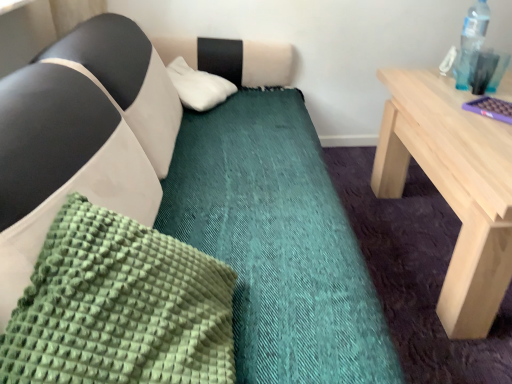
Identify the location of green textured pillow at lower left, arranged as the 1th pillow when viewed from the front. The image size is (512, 384). (119, 307).

Does point (469, 21) come in front of point (216, 84)?

Yes, point (469, 21) is in front of point (216, 84).

From a real-world perspective, who is located lower, transparent plastic bottle at upper right or white fluffy pillow at upper center, marked as the first pillow in a back-to-front arrangement?

white fluffy pillow at upper center, marked as the first pillow in a back-to-front arrangement, from a real-world perspective.

Relative to white fluffy pillow at upper center, placed as the second pillow when sorted from bottom to top, is transparent plastic bottle at upper right in front or behind?

In the image, transparent plastic bottle at upper right appears in front of white fluffy pillow at upper center, placed as the second pillow when sorted from bottom to top.

From the image's perspective, would you say transparent plastic bottle at upper right is positioned over white fluffy pillow at upper center, placed as the second pillow when sorted from bottom to top?

Yes.

Which is less distant, [192,90] or [465,48]?

Point [192,90] is positioned farther from the camera compared to point [465,48].

Considering the relative sizes of white fluffy pillow at upper center, marked as the first pillow in a back-to-front arrangement, and transparent plastic bottle at upper right in the image provided, is white fluffy pillow at upper center, marked as the first pillow in a back-to-front arrangement, wider than transparent plastic bottle at upper right?

Yes, white fluffy pillow at upper center, marked as the first pillow in a back-to-front arrangement, is wider than transparent plastic bottle at upper right.

Is white fluffy pillow at upper center, placed as the second pillow when sorted from bottom to top, positioned with its back to transparent plastic bottle at upper right?

No, white fluffy pillow at upper center, placed as the second pillow when sorted from bottom to top, is not facing away from transparent plastic bottle at upper right.

Is white fluffy pillow at upper center, which is the 1th pillow from top to bottom, facing towards green textured pillow at lower left, which appears as the 2th pillow when viewed from the back?

No.

From the image's perspective, is white fluffy pillow at upper center, which is the 1th pillow from top to bottom, located above green textured pillow at lower left, placed as the second pillow when sorted from top to bottom?

Indeed, from the image's perspective, white fluffy pillow at upper center, which is the 1th pillow from top to bottom, is shown above green textured pillow at lower left, placed as the second pillow when sorted from top to bottom.

From the picture: From a real-world perspective, between white fluffy pillow at upper center, placed as the second pillow when sorted from bottom to top, and green textured pillow at lower left, arranged as the 1th pillow when viewed from the front, who is vertically higher?

From a 3D spatial view, green textured pillow at lower left, arranged as the 1th pillow when viewed from the front, is above.

Which object is positioned more to the right, white fluffy pillow at upper center, marked as the first pillow in a back-to-front arrangement, or green textured pillow at lower left, the 1th pillow from the bottom?

green textured pillow at lower left, the 1th pillow from the bottom.

Could you tell me if transparent plastic bottle at upper right is facing green textured pillow at lower left, arranged as the 1th pillow when viewed from the front?

No, transparent plastic bottle at upper right is not oriented towards green textured pillow at lower left, arranged as the 1th pillow when viewed from the front.

From the image's perspective, which object appears higher, transparent plastic bottle at upper right or green textured pillow at lower left, the 1th pillow from the bottom?

From the image's view, transparent plastic bottle at upper right is above.

Is transparent plastic bottle at upper right further to camera compared to green textured pillow at lower left, the 1th pillow from the bottom?

Yes, transparent plastic bottle at upper right is further from the viewer.

Considering the positions of point (478, 44) and point (60, 356), is point (478, 44) closer or farther from the camera than point (60, 356)?

Point (478, 44) is positioned farther from the camera compared to point (60, 356).

From the image's perspective, who appears lower, green textured pillow at lower left, arranged as the 1th pillow when viewed from the front, or white fluffy pillow at upper center, marked as the first pillow in a back-to-front arrangement?

green textured pillow at lower left, arranged as the 1th pillow when viewed from the front, is shown below in the image.

Between green textured pillow at lower left, arranged as the 1th pillow when viewed from the front, and white fluffy pillow at upper center, the second pillow when ordered from front to back, which one appears on the right side from the viewer's perspective?

Positioned to the right is green textured pillow at lower left, arranged as the 1th pillow when viewed from the front.

Between green textured pillow at lower left, placed as the second pillow when sorted from top to bottom, and white fluffy pillow at upper center, which is the 1th pillow from top to bottom, which one has larger width?

With larger width is white fluffy pillow at upper center, which is the 1th pillow from top to bottom.

From a real-world perspective, is green textured pillow at lower left, which appears as the 2th pillow when viewed from the back, physically above white fluffy pillow at upper center, the second pillow when ordered from front to back?

Indeed, from a real-world perspective, green textured pillow at lower left, which appears as the 2th pillow when viewed from the back, stands above white fluffy pillow at upper center, the second pillow when ordered from front to back.

From a real-world perspective, is green textured pillow at lower left, which appears as the 2th pillow when viewed from the back, physically located above or below transparent plastic bottle at upper right?

green textured pillow at lower left, which appears as the 2th pillow when viewed from the back, is below transparent plastic bottle at upper right.

Considering the sizes of green textured pillow at lower left, arranged as the 1th pillow when viewed from the front, and transparent plastic bottle at upper right in the image, is green textured pillow at lower left, arranged as the 1th pillow when viewed from the front, taller or shorter than transparent plastic bottle at upper right?

Clearly, green textured pillow at lower left, arranged as the 1th pillow when viewed from the front, is shorter compared to transparent plastic bottle at upper right.

Considering the positions of objects green textured pillow at lower left, which appears as the 2th pillow when viewed from the back, and transparent plastic bottle at upper right in the image provided, who is behind, green textured pillow at lower left, which appears as the 2th pillow when viewed from the back, or transparent plastic bottle at upper right?

Positioned behind is transparent plastic bottle at upper right.

Considering the relative positions of green textured pillow at lower left, placed as the second pillow when sorted from top to bottom, and transparent plastic bottle at upper right in the image provided, is green textured pillow at lower left, placed as the second pillow when sorted from top to bottom, to the left or to the right of transparent plastic bottle at upper right?

Based on their positions, green textured pillow at lower left, placed as the second pillow when sorted from top to bottom, is located to the left of transparent plastic bottle at upper right.

Where is `pillow behind the transparent plastic bottle at upper right`? pillow behind the transparent plastic bottle at upper right is located at coordinates (198, 86).

Locate an element on the screen. The height and width of the screenshot is (384, 512). the 1st pillow below the transparent plastic bottle at upper right (from the image's perspective) is located at coordinates (198, 86).

Based on their spatial positions, is white fluffy pillow at upper center, the second pillow when ordered from front to back, or green textured pillow at lower left, placed as the second pillow when sorted from top to bottom, further from transparent plastic bottle at upper right?

green textured pillow at lower left, placed as the second pillow when sorted from top to bottom.

Considering their positions, is green textured pillow at lower left, the 1th pillow from the bottom, positioned further to transparent plastic bottle at upper right than white fluffy pillow at upper center, which is the 1th pillow from top to bottom?

The object further to transparent plastic bottle at upper right is green textured pillow at lower left, the 1th pillow from the bottom.

Based on their spatial positions, is transparent plastic bottle at upper right or white fluffy pillow at upper center, marked as the first pillow in a back-to-front arrangement, further from green textured pillow at lower left, which appears as the 2th pillow when viewed from the back?

transparent plastic bottle at upper right.

Which object lies nearer to the anchor point white fluffy pillow at upper center, marked as the first pillow in a back-to-front arrangement, green textured pillow at lower left, placed as the second pillow when sorted from top to bottom, or transparent plastic bottle at upper right?

The object closer to white fluffy pillow at upper center, marked as the first pillow in a back-to-front arrangement, is transparent plastic bottle at upper right.

From the image, which object appears to be farther from white fluffy pillow at upper center, which is the 1th pillow from top to bottom, transparent plastic bottle at upper right or green textured pillow at lower left, placed as the second pillow when sorted from top to bottom?

green textured pillow at lower left, placed as the second pillow when sorted from top to bottom.

Based on their spatial positions, is white fluffy pillow at upper center, which is the 1th pillow from top to bottom, or transparent plastic bottle at upper right further from green textured pillow at lower left, which appears as the 2th pillow when viewed from the back?

Based on the image, transparent plastic bottle at upper right appears to be further to green textured pillow at lower left, which appears as the 2th pillow when viewed from the back.

Where is `bottle between green textured pillow at lower left, the 1th pillow from the bottom, and white fluffy pillow at upper center, marked as the first pillow in a back-to-front arrangement, in the front-back direction`? Image resolution: width=512 pixels, height=384 pixels. bottle between green textured pillow at lower left, the 1th pillow from the bottom, and white fluffy pillow at upper center, marked as the first pillow in a back-to-front arrangement, in the front-back direction is located at coordinates (471, 42).